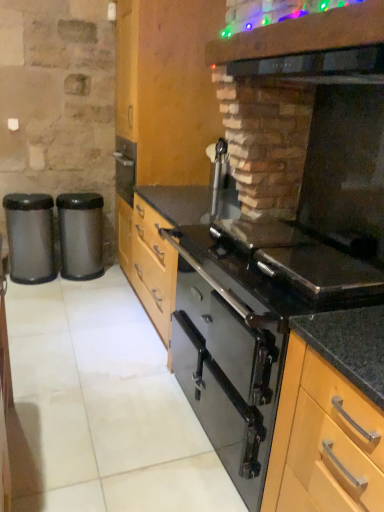
Question: Would you say black glass oven at center is inside or outside wooden cabinet at center, the 2th cabinetry when ordered from bottom to top?

Choices:
 (A) inside
 (B) outside

Answer: (B)

Question: Considering the positions of black glass oven at center and wooden cabinet at center, arranged as the 1th cabinetry when viewed from the top, in the image, is black glass oven at center taller or shorter than wooden cabinet at center, arranged as the 1th cabinetry when viewed from the top,?

Choices:
 (A) short
 (B) tall

Answer: (A)

Question: Which is nearer to the black glass exhaust hood at upper right?

Choices:
 (A) wooden cabinet at center, which is the first cabinetry in back-to-front order
 (B) metallic trash can at left, which ranks as the 1th waste container in left-to-right order
 (C) satin black trash can at left, arranged as the 2th waste container when viewed from the left
 (D) black glossy vent at upper center
 (E) black glass oven at center

Answer: (D)

Question: Which object is the farthest from the satin black trash can at left, the first waste container from the right?

Choices:
 (A) black glass exhaust hood at upper right
 (B) light wood cabinet at center, arranged as the 2th cabinetry when viewed from the left
 (C) black glossy vent at upper center
 (D) black glass oven at center
 (E) wooden cabinet at center, the 1th cabinetry when ordered from left to right

Answer: (B)